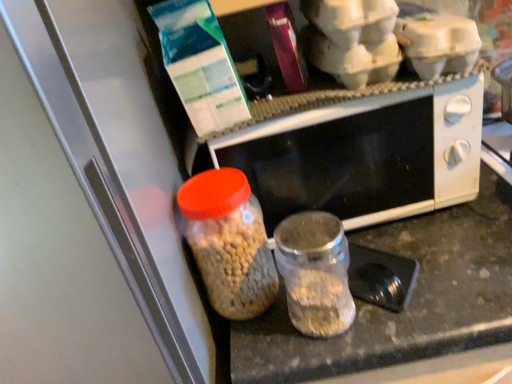
Find the location of `translucent glass jar at center, the second bottle from the right`. translucent glass jar at center, the second bottle from the right is located at coordinates (229, 242).

Where is `black matte microwave at center`? black matte microwave at center is located at coordinates (357, 153).

This screenshot has width=512, height=384. I want to click on transparent glass jar at center, acting as the first bottle starting from the right, so click(x=315, y=273).

Locate an element on the screen. translucent glass jar at center, the second bottle from the right is located at coordinates (x=229, y=242).

From a real-world perspective, is black matte microwave at center below translucent glass jar at center, the second bottle from the right?

Actually, black matte microwave at center is physically above translucent glass jar at center, the second bottle from the right, in the real world.

Considering the relative sizes of black matte microwave at center and translucent glass jar at center, the second bottle from the right, in the image provided, is black matte microwave at center shorter than translucent glass jar at center, the second bottle from the right,?

In fact, black matte microwave at center may be taller than translucent glass jar at center, the second bottle from the right.

Does point (386, 97) come farther from viewer compared to point (259, 271)?

Yes, point (386, 97) is farther from viewer.

This screenshot has height=384, width=512. I want to click on the 1st bottle in front when counting from the black matte microwave at center, so click(x=229, y=242).

Is translucent glass jar at center, which ranks as the 1th bottle in left-to-right order, facing towards black matte microwave at center?

No.

Considering the positions of objects translucent glass jar at center, which ranks as the 1th bottle in left-to-right order, and black matte microwave at center in the image provided, who is more to the right, translucent glass jar at center, which ranks as the 1th bottle in left-to-right order, or black matte microwave at center?

From the viewer's perspective, black matte microwave at center appears more on the right side.

Considering the relative sizes of translucent glass jar at center, which ranks as the 1th bottle in left-to-right order, and black matte microwave at center in the image provided, is translucent glass jar at center, which ranks as the 1th bottle in left-to-right order, smaller than black matte microwave at center?

Correct, translucent glass jar at center, which ranks as the 1th bottle in left-to-right order, occupies less space than black matte microwave at center.

Identify the location of bottle in front of the translucent glass jar at center, the second bottle from the right. (315, 273).

From a real-world perspective, is transparent glass jar at center, acting as the first bottle starting from the right, beneath translucent glass jar at center, which ranks as the 1th bottle in left-to-right order?

Yes, from a real-world perspective, transparent glass jar at center, acting as the first bottle starting from the right, is below translucent glass jar at center, which ranks as the 1th bottle in left-to-right order.

From the image's perspective, does transparent glass jar at center, which is counted as the second bottle, starting from the left, appear higher than translucent glass jar at center, which ranks as the 1th bottle in left-to-right order?

No, from the image's perspective, transparent glass jar at center, which is counted as the second bottle, starting from the left, is not over translucent glass jar at center, which ranks as the 1th bottle in left-to-right order.

Does point (286, 232) come closer to viewer compared to point (232, 184)?

Yes, point (286, 232) is in front of point (232, 184).

Can you tell me how much transparent glass jar at center, acting as the first bottle starting from the right, and black matte microwave at center differ in facing direction?

The angle between the facing direction of transparent glass jar at center, acting as the first bottle starting from the right, and the facing direction of black matte microwave at center is 0.351 degrees.

How distant is transparent glass jar at center, acting as the first bottle starting from the right, from black matte microwave at center?

6.96 inches.

Considering the positions of point (295, 224) and point (361, 181), is point (295, 224) closer or farther from the camera than point (361, 181)?

Point (295, 224) is positioned closer to the camera compared to point (361, 181).

From a real-world perspective, is transparent glass jar at center, acting as the first bottle starting from the right, on black matte microwave at center?

Incorrect, from a real-world perspective, transparent glass jar at center, acting as the first bottle starting from the right, is lower than black matte microwave at center.

Between point (474, 171) and point (338, 228), which one is positioned in front?

The point (338, 228) is closer to the camera.

Which of these two, black matte microwave at center or transparent glass jar at center, which is counted as the second bottle, starting from the left, is bigger?

black matte microwave at center is bigger.

From the image's perspective, is black matte microwave at center above or below transparent glass jar at center, acting as the first bottle starting from the right?

Clearly, from the image's perspective, black matte microwave at center is above transparent glass jar at center, acting as the first bottle starting from the right.

Looking at this image, can we say black matte microwave at center lies outside transparent glass jar at center, which is counted as the second bottle, starting from the left?

Indeed, black matte microwave at center is completely outside transparent glass jar at center, which is counted as the second bottle, starting from the left.

Between translucent glass jar at center, the second bottle from the right, and transparent glass jar at center, acting as the first bottle starting from the right, which one appears on the left side from the viewer's perspective?

From the viewer's perspective, translucent glass jar at center, the second bottle from the right, appears more on the left side.

Is translucent glass jar at center, the second bottle from the right, wider than transparent glass jar at center, acting as the first bottle starting from the right?

Yes, translucent glass jar at center, the second bottle from the right, is wider than transparent glass jar at center, acting as the first bottle starting from the right.

From the image's perspective, is translucent glass jar at center, the second bottle from the right, positioned above or below transparent glass jar at center, which is counted as the second bottle, starting from the left?

translucent glass jar at center, the second bottle from the right, is above transparent glass jar at center, which is counted as the second bottle, starting from the left.

Identify the location of microwave oven above the translucent glass jar at center, which ranks as the 1th bottle in left-to-right order (from a real-world perspective). (357, 153).

Find the location of `microwave oven behind the translucent glass jar at center, the second bottle from the right`. microwave oven behind the translucent glass jar at center, the second bottle from the right is located at coordinates (357, 153).

In the scene shown: Which object lies further to the anchor point transparent glass jar at center, acting as the first bottle starting from the right, black matte microwave at center or translucent glass jar at center, which ranks as the 1th bottle in left-to-right order?

The object further to transparent glass jar at center, acting as the first bottle starting from the right, is black matte microwave at center.

Looking at the image, which one is located further to black matte microwave at center, transparent glass jar at center, which is counted as the second bottle, starting from the left, or translucent glass jar at center, which ranks as the 1th bottle in left-to-right order?

The object further to black matte microwave at center is translucent glass jar at center, which ranks as the 1th bottle in left-to-right order.

Which object lies nearer to the anchor point transparent glass jar at center, acting as the first bottle starting from the right, translucent glass jar at center, the second bottle from the right, or black matte microwave at center?

translucent glass jar at center, the second bottle from the right, lies closer to transparent glass jar at center, acting as the first bottle starting from the right, than the other object.

From the picture: Which object lies further to the anchor point translucent glass jar at center, which ranks as the 1th bottle in left-to-right order, black matte microwave at center or transparent glass jar at center, acting as the first bottle starting from the right?

black matte microwave at center lies further to translucent glass jar at center, which ranks as the 1th bottle in left-to-right order, than the other object.

When comparing their distances from translucent glass jar at center, which ranks as the 1th bottle in left-to-right order, does transparent glass jar at center, acting as the first bottle starting from the right, or black matte microwave at center seem further?

black matte microwave at center.

Estimate the real-world distances between objects in this image. Which object is closer to black matte microwave at center, translucent glass jar at center, which ranks as the 1th bottle in left-to-right order, or transparent glass jar at center, acting as the first bottle starting from the right?

Based on the image, transparent glass jar at center, acting as the first bottle starting from the right, appears to be nearer to black matte microwave at center.

The image size is (512, 384). I want to click on bottle between black matte microwave at center and transparent glass jar at center, which is counted as the second bottle, starting from the left, vertically, so click(x=229, y=242).